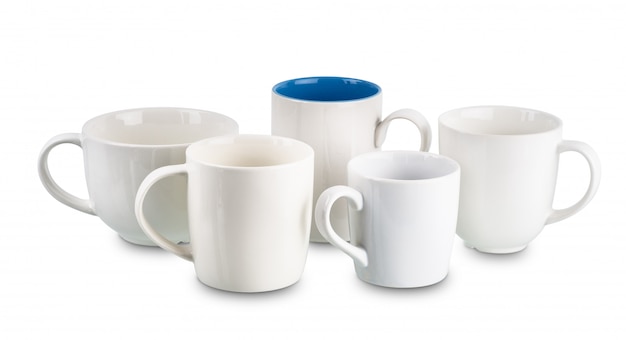
Where is `white exterior of mug`? white exterior of mug is located at coordinates (116, 182), (244, 213), (336, 139), (406, 238), (510, 182).